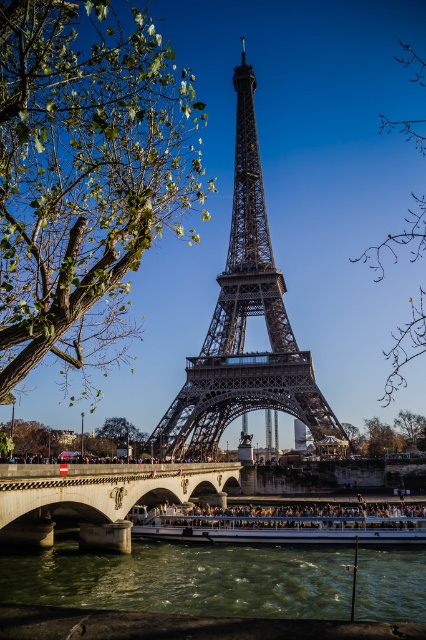
You are a tour guide planning a walking route for visitors. The route needs to start at the green leafy tree at left and end at the white glossy boat at lower center. What is the minimum distance the visitors must walk to reach the boat from the tree?

The green leafy tree at left and white glossy boat at lower center are 80.80 meters apart, so the minimum distance visitors must walk is 80.80 meters.

You are standing on the bridge over the Seine River and want to take a photo of the green water at lower center. Based on its coordinates, where should you position yourself to capture it in the frame?

The green water at lower center is located at coordinates point (184, 579), so you should position yourself near the lower center area of the bridge to capture it in the frame.

You are a tourist standing on the bridge and want to take a photo of the green leafy tree at left and the green water at lower center. Which object will appear larger in your camera view?

The green leafy tree at left will appear larger in your camera view because it is much taller than the green water at lower center.